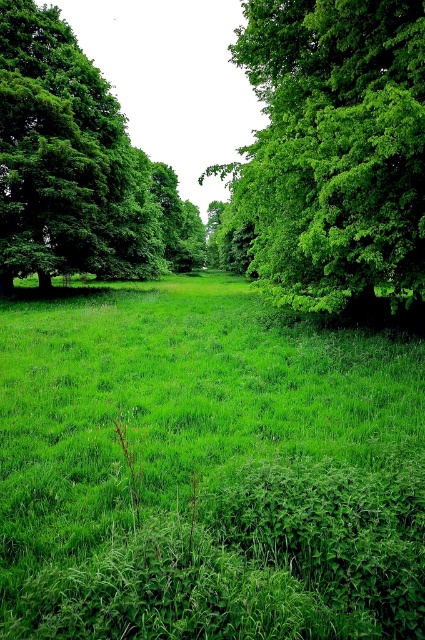
From the picture: Does green leafy tree at center appear under green leafy tree at left?

Indeed, green leafy tree at center is positioned under green leafy tree at left.

Which is in front, point (376, 17) or point (17, 129)?

Positioned in front is point (376, 17).

Where is `green leafy tree at center`? green leafy tree at center is located at coordinates (334, 148).

Can you confirm if green grassy at center is shorter than green leafy tree at left?

Correct, green grassy at center is not as tall as green leafy tree at left.

Does green grassy at center have a larger size compared to green leafy tree at left?

No, green grassy at center is not bigger than green leafy tree at left.

Where is `green grassy at center`? This screenshot has height=640, width=425. green grassy at center is located at coordinates (206, 468).

Who is more forward, (223, 624) or (362, 77)?

Positioned in front is point (223, 624).

Which is in front, point (124, 324) or point (399, 248)?

Positioned in front is point (399, 248).

At what (x,y) coordinates should I click in order to perform the action: click on green grassy at center. Please return your answer as a coordinate pair (x, y). Image resolution: width=425 pixels, height=640 pixels. Looking at the image, I should click on (206, 468).